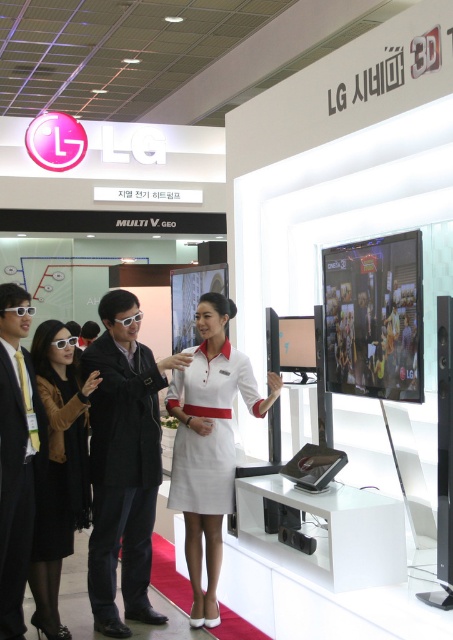
You are a photographer at the event and want to take a photo of the LG Cinema 3D screen. To ensure the black fabric dress at center is not blocking the view, where should you position yourself relative to the dress?

Since the black fabric dress at center is located at point 0.733 on the x axis and 0.132 on the y axis, positioning yourself to the left or right of this coordinate would ensure the dress does not block the view of the LG Cinema 3D screen.

You are attending the LG exhibition and see a woman in a black matte suit at center and a white fabric dress at center. Which one is closer to you?

The black matte suit at center is closer to you because it is in front of the white fabric dress at center.